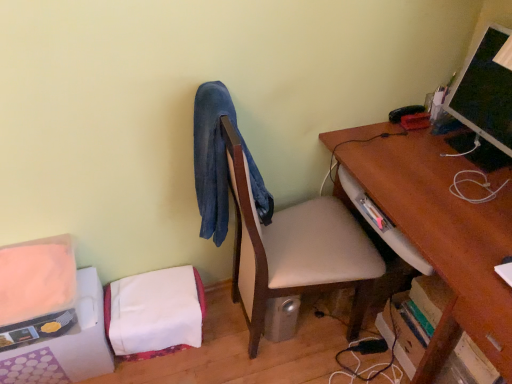
This screenshot has height=384, width=512. Find the location of `vacant space that is to the left of matte black monitor at upper right`. vacant space that is to the left of matte black monitor at upper right is located at coordinates (426, 152).